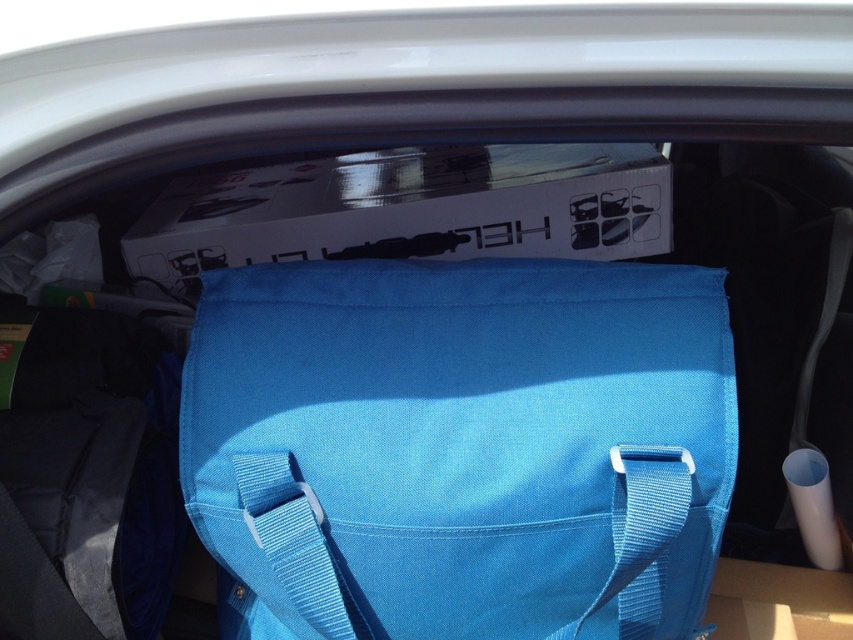
You are trying to fit a new item into the car trunk. You see the blue canvas bag at center and the blue fabric strap at center. Which one takes up more space in the trunk?

The blue canvas bag at center has a larger size compared to the blue fabric strap at center, so it takes up more space in the trunk.

You are standing in front of the car trunk and want to reach the point marked at coordinates (548,445). If your arm can extend 25 inches, can you reach that point?

The distance between you and the point is 27.58 inches, which is longer than your arm can reach. You cannot reach the point.